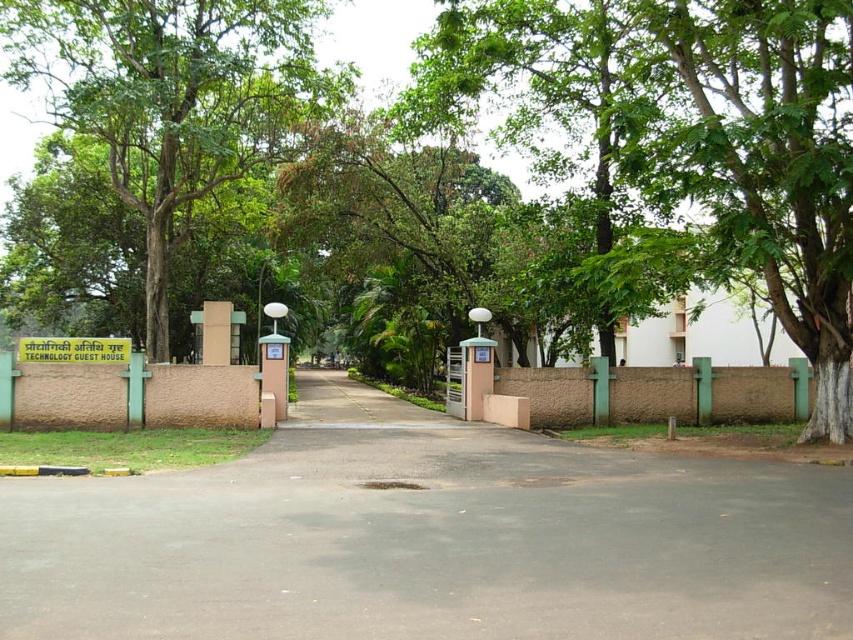
Between black asphalt driveway at center and green leafy tree at center, which one has more height?

A: Standing taller between the two is green leafy tree at center.

Which is below, black asphalt driveway at center or green leafy tree at center?

Positioned lower is black asphalt driveway at center.

Identify the location of black asphalt driveway at center. (428, 540).

Which is below, black asphalt driveway at center or green plastic sign at center?

black asphalt driveway at center is below.

Is black asphalt driveway at center in front of green plastic sign at center?

Yes, it is.

Find the location of `black asphalt driveway at center`. black asphalt driveway at center is located at coordinates (428, 540).

Can you confirm if green leafy tree at center is smaller than green plastic sign at center?

No, green leafy tree at center is not smaller than green plastic sign at center.

Can you confirm if green leafy tree at center is bigger than green plastic sign at center?

Yes, green leafy tree at center is bigger than green plastic sign at center.

Find the location of a particular element. The height and width of the screenshot is (640, 853). green leafy tree at center is located at coordinates (688, 132).

The width and height of the screenshot is (853, 640). What are the coordinates of `green leafy tree at center` in the screenshot? It's located at (688, 132).